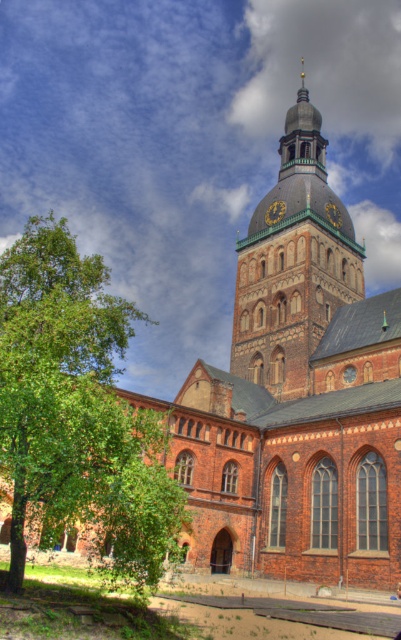
Between brown brick tower at center and gold metallic clock at upper center, which one has less height?

gold metallic clock at upper center is shorter.

What do you see at coordinates (293, 264) in the screenshot? The height and width of the screenshot is (640, 401). I see `brown brick tower at center` at bounding box center [293, 264].

Identify the location of brown brick tower at center. This screenshot has width=401, height=640. (293, 264).

Locate an element on the screen. gold metallic clock at upper center is located at coordinates (275, 212).

Does gold metallic clock at upper center have a greater width compared to gold textured clock at center?

No, gold metallic clock at upper center is not wider than gold textured clock at center.

Between point (275, 209) and point (330, 218), which one is positioned behind?

The point (275, 209) is more distant.

This screenshot has height=640, width=401. In order to click on gold metallic clock at upper center in this screenshot , I will do `click(275, 212)`.

Does point (117, 412) lie behind point (271, 304)?

That is False.

Between green leafy tree at lower left and brown brick tower at center, which one is positioned higher?

brown brick tower at center is above.

From the picture: Who is more distant from viewer, (36, 273) or (307, 378)?

The point (307, 378) is behind.

At what (x,y) coordinates should I click in order to perform the action: click on green leafy tree at lower left. Please return your answer as a coordinate pair (x, y). This screenshot has width=401, height=640. Looking at the image, I should click on (76, 410).